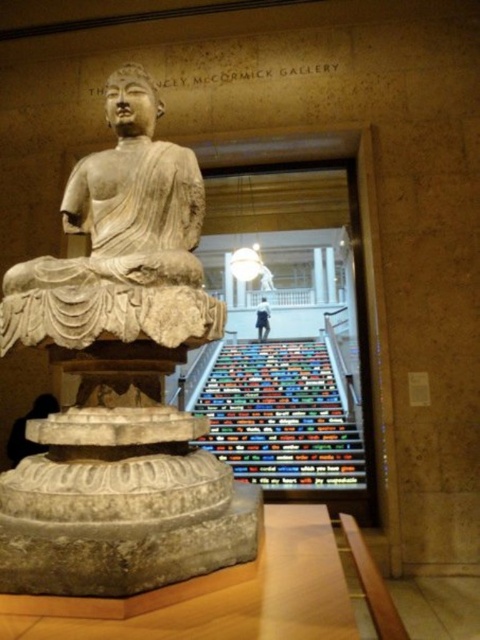
Consider the image. You are standing in the museum and want to touch the point at coordinates point (117, 328). Can you reach it without moving your body?

The point (117, 328) is 1.68 meters away from the viewer. Since the average human arm length is about 0.7 meters, you cannot reach it without moving your body.

You are standing in the museum and see two points marked in the scene. The first point is at coordinates point (104,257) and the second is at point (194,230). Which point is closer to you?

Point (104,257) is closer to the viewer than point (194,230).